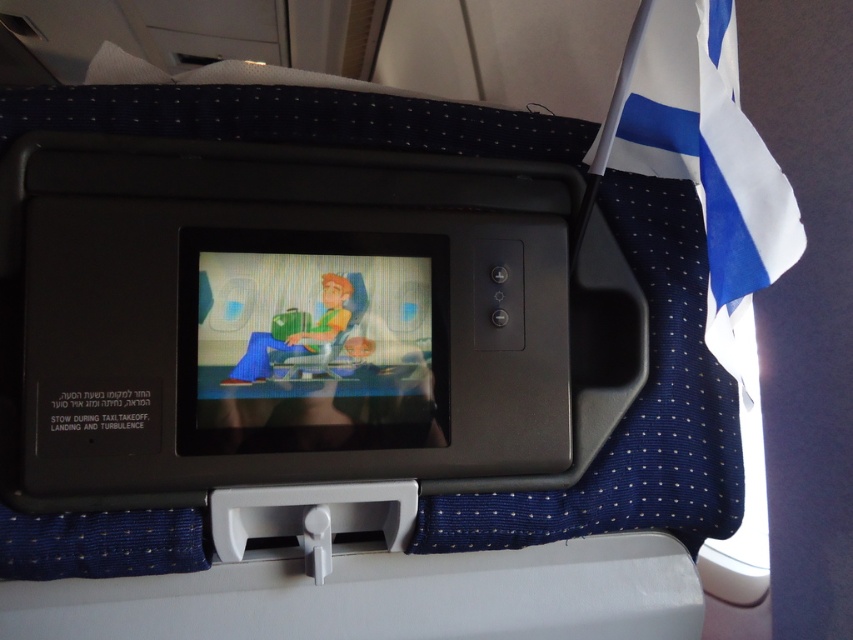
The height and width of the screenshot is (640, 853). Describe the element at coordinates (311, 340) in the screenshot. I see `matte plastic screen at center` at that location.

Between point (193, 298) and point (608, 164), which one is positioned in front?

Point (193, 298)

This screenshot has width=853, height=640. In order to click on matte plastic screen at center in this screenshot , I will do `click(311, 340)`.